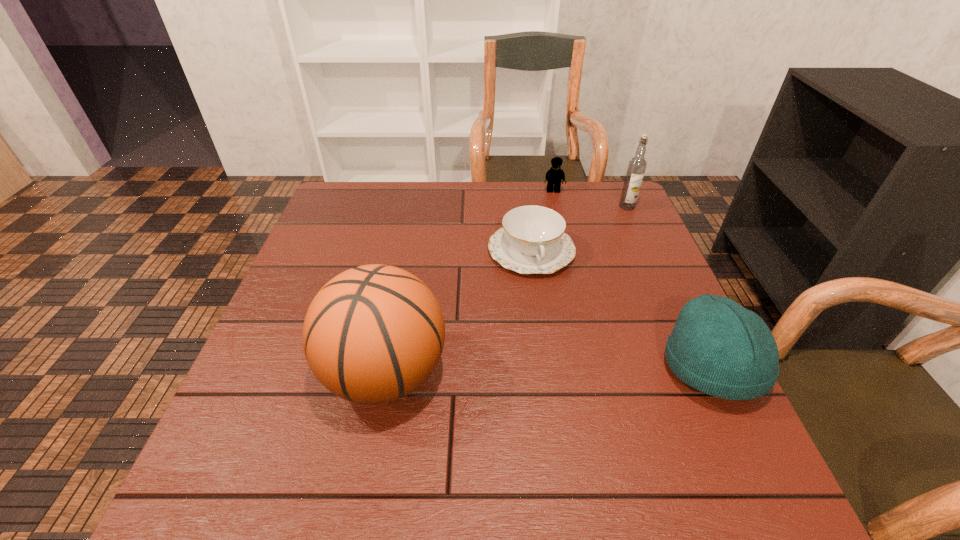
Where is `free space located 0.320m on the handle side of the shortest object`? The image size is (960, 540). free space located 0.320m on the handle side of the shortest object is located at coordinates (579, 392).

You are a GUI agent. You are given a task and a screenshot of the screen. Output one action in this format:
    pyautogui.click(x=<x>, y=<y>)
    Task: Click on the vacant space situated on the handle side of the shortest object
    
    Given the screenshot: What is the action you would take?
    pyautogui.click(x=550, y=306)

Where is `vacant point located 0.140m on the front-facing side of the Lego`? The image size is (960, 540). vacant point located 0.140m on the front-facing side of the Lego is located at coordinates (559, 221).

Locate an element on the screen. The height and width of the screenshot is (540, 960). vacant area situated on the front-facing side of the Lego is located at coordinates (558, 213).

Locate an element on the screen. The width and height of the screenshot is (960, 540). blank space located on the front-facing side of the Lego is located at coordinates (561, 232).

This screenshot has width=960, height=540. Identify the location of vacant space located on the label of the vodka. (603, 259).

What are the coordinates of `vacant space situated on the label of the vodka` in the screenshot? It's located at (607, 253).

Identify the location of blank area located on the label of the vodka. (601, 264).

The width and height of the screenshot is (960, 540). I want to click on chinaware that is at the far edge, so click(532, 240).

Find the location of a particular element. Lego that is at the far edge is located at coordinates (554, 176).